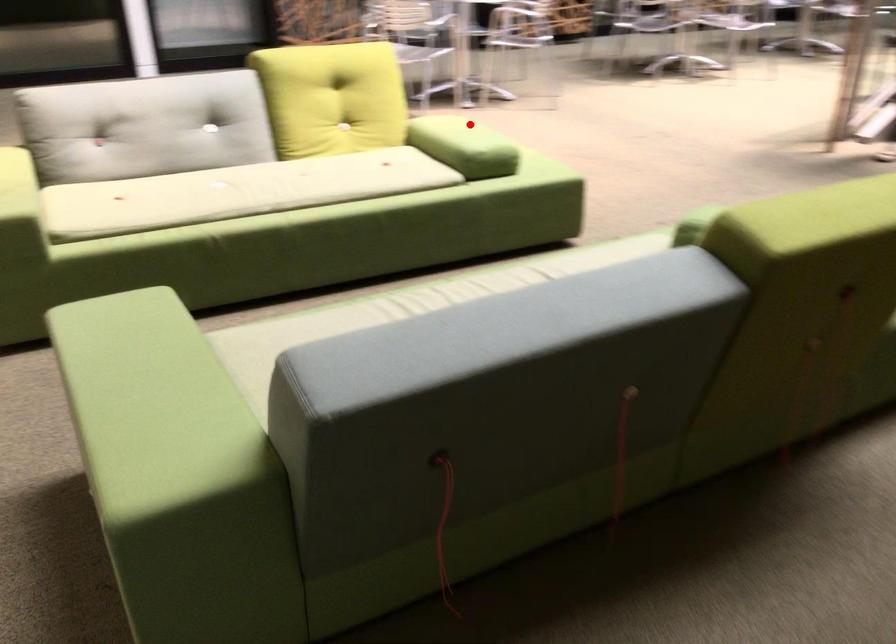
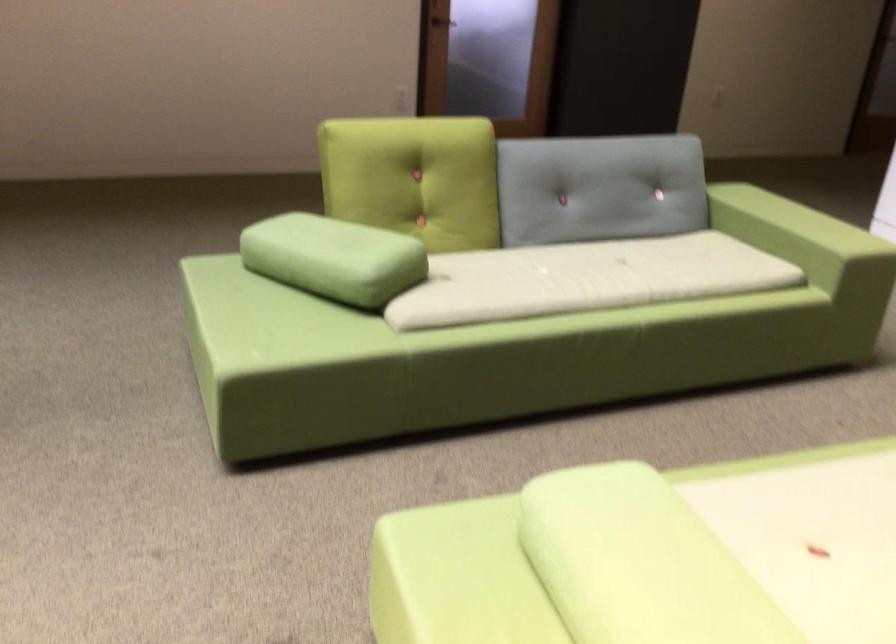
Question: I am providing you with two images of the same scene from different viewpoints. Image1 has a red point marked. In image2, the corresponding 3D location appears at what relative position? Reply with the corresponding letter.

Choices:
 (A) Closer
 (B) Farther

Answer: (A)